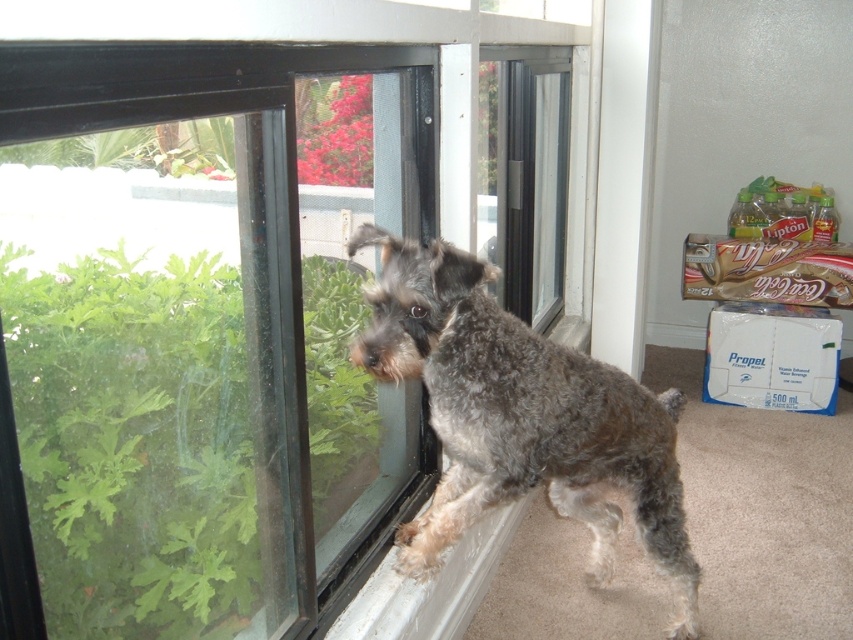
Question: Where is clear glass window at center located in relation to gray shaggy dog at window in the image?

Choices:
 (A) below
 (B) above

Answer: (B)

Question: Can you confirm if clear glass window at center is bigger than gray shaggy dog at window?

Choices:
 (A) yes
 (B) no

Answer: (A)

Question: Is clear glass window at center positioned behind gray shaggy dog at window?

Choices:
 (A) yes
 (B) no

Answer: (B)